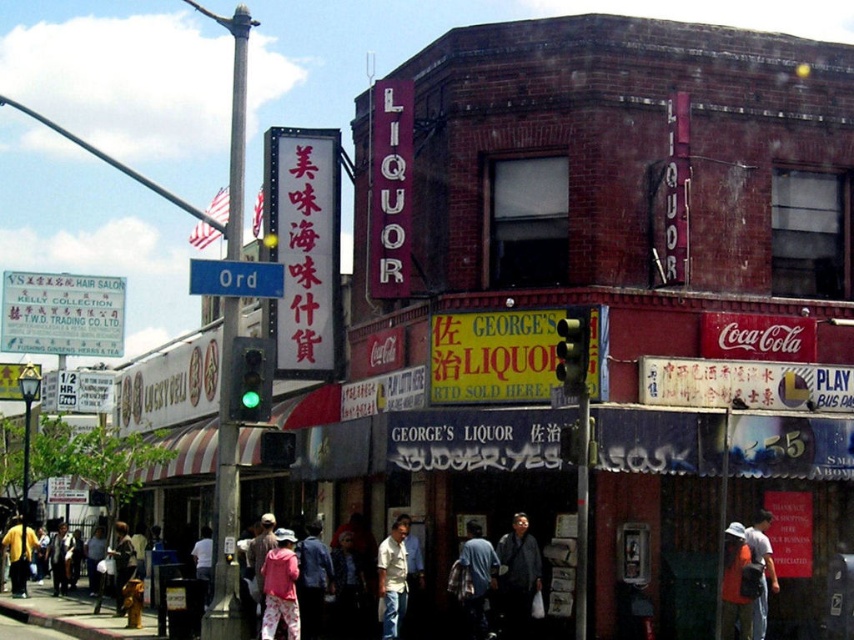
Question: Does dark blue shirt at center appear on the left side of light beige shirt at center?

Choices:
 (A) no
 (B) yes

Answer: (A)

Question: Which point is farther from the camera taking this photo?

Choices:
 (A) (27, 566)
 (B) (34, 316)
 (C) (390, 605)
 (D) (735, 577)

Answer: (B)

Question: Is concrete sidewalk at lower left positioned at the back of orange cotton shirt at lower right?

Choices:
 (A) no
 (B) yes

Answer: (B)

Question: Which of the following is the farthest from the observer?

Choices:
 (A) white cotton shirt at lower right
 (B) yellow matte jacket at lower left

Answer: (B)

Question: Which of the following is the farthest from the observer?

Choices:
 (A) white paper sign at left
 (B) denim jacket at center
 (C) orange cotton shirt at lower right

Answer: (A)

Question: Does white paper sign at left appear over blue metallic street sign at upper center?

Choices:
 (A) yes
 (B) no

Answer: (B)